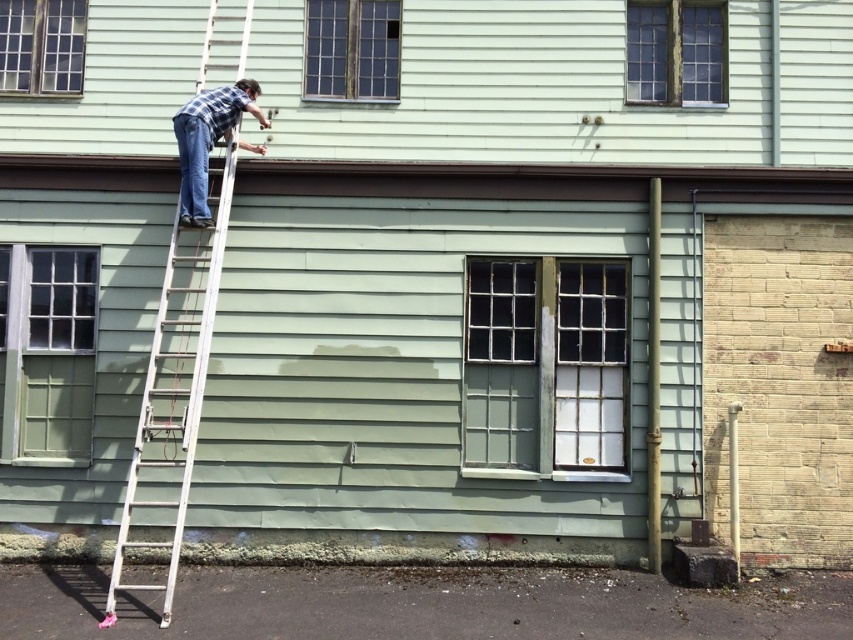
Question: Which of the following is the farthest from the observer?

Choices:
 (A) clear glass window at upper left
 (B) wooden grid window at upper center
 (C) white metallic ladder at left

Answer: (A)

Question: Is matte glass window at center to the right of white metallic ladder at left from the viewer's perspective?

Choices:
 (A) yes
 (B) no

Answer: (A)

Question: Among these points, which one is nearest to the camera?

Choices:
 (A) (309, 61)
 (B) (196, 380)
 (C) (469, 442)
 (D) (48, 20)

Answer: (B)

Question: Is white metallic ladder at left wider than matte green window at lower left?

Choices:
 (A) yes
 (B) no

Answer: (A)

Question: Which point is closer to the camera?

Choices:
 (A) clear glass window at upper left
 (B) white metallic ladder at left

Answer: (B)

Question: Is matte glass window at center closer to camera compared to plaid flannel shirt at upper center?

Choices:
 (A) yes
 (B) no

Answer: (B)